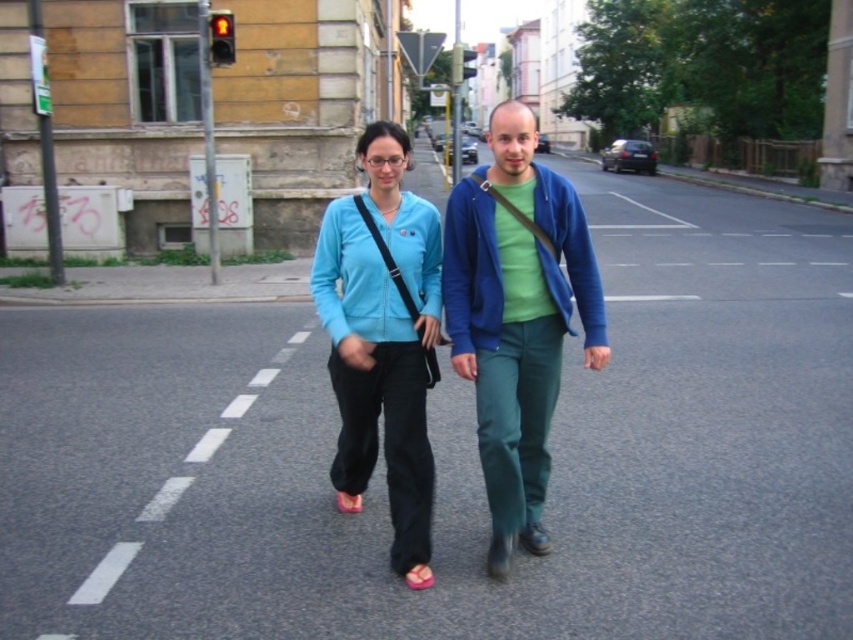
Question: Is the position of matte blue jacket at center less distant than that of matte blue sweater at center?

Choices:
 (A) no
 (B) yes

Answer: (B)

Question: Can you confirm if matte blue jacket at center is positioned to the left of matte blue sweater at center?

Choices:
 (A) yes
 (B) no

Answer: (B)

Question: Is matte blue jacket at center smaller than matte blue sweater at center?

Choices:
 (A) no
 (B) yes

Answer: (A)